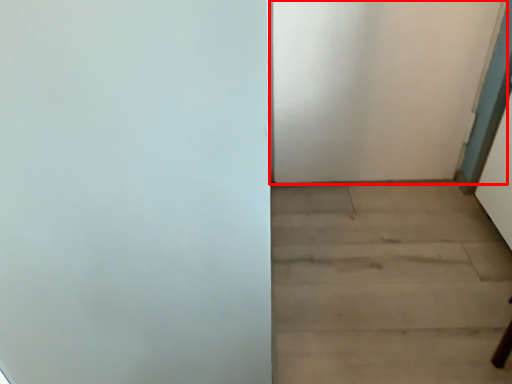
Question: From the image's perspective, where is door (annotated by the red box) located relative to stairwell?

Choices:
 (A) below
 (B) above

Answer: (B)